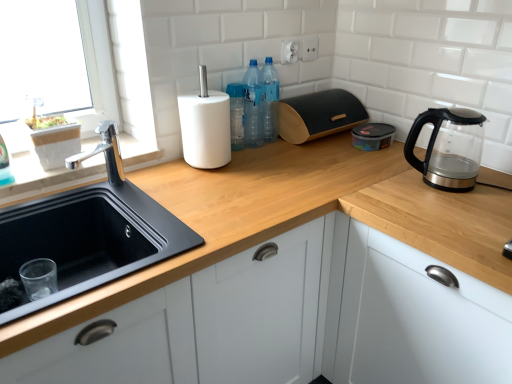
You are a GUI agent. You are given a task and a screenshot of the screen. Output one action in this format:
    pyautogui.click(x=<x>, y=<y>)
    Task: Click on the free space to the left of transparent glass kettle at right
    This screenshot has width=512, height=384.
    Given the screenshot: What is the action you would take?
    pyautogui.click(x=393, y=185)